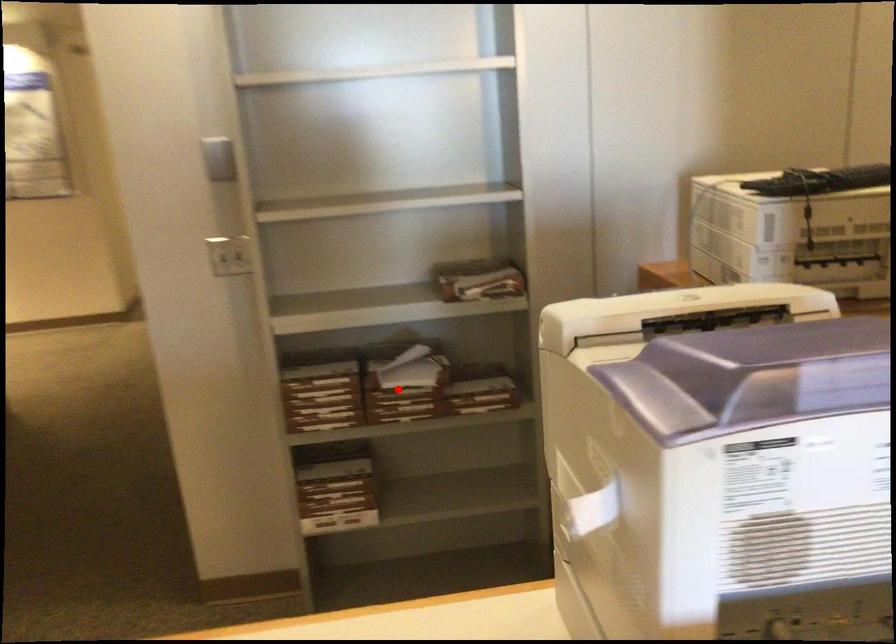
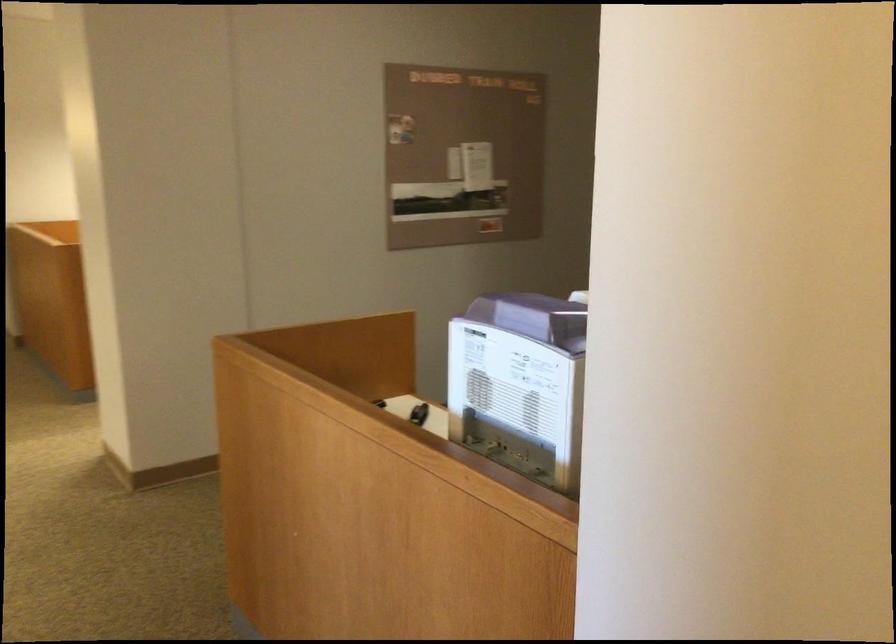
Question: I am providing you with two images of the same scene from different viewpoints. A red point is marked on the first image. Can you still see the location of the red point in image 2?

Choices:
 (A) Yes
 (B) No

Answer: (B)